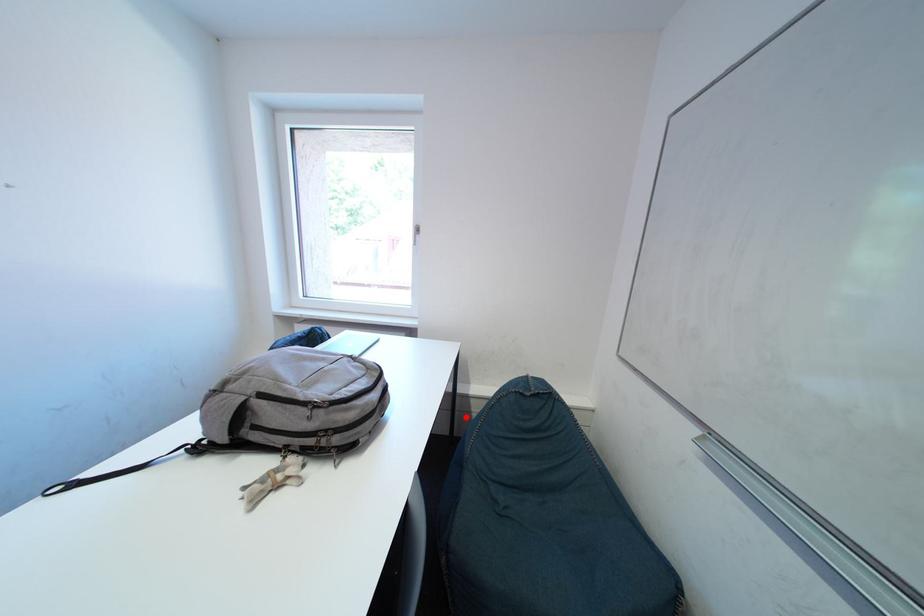
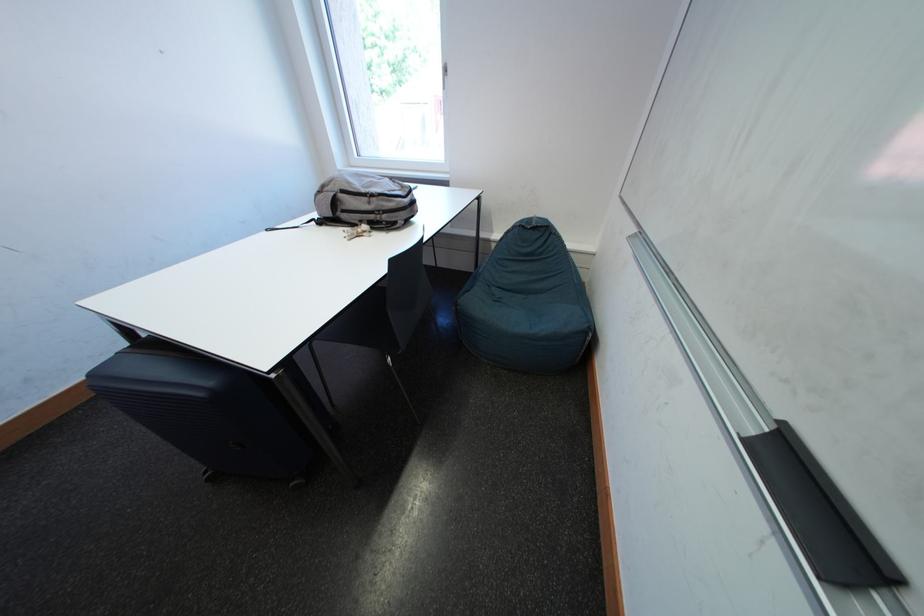
Question: I am providing you with two images of the same scene from different viewpoints. In image1, a red point is highlighted. Considering the same 3D point in image2, which of the following is correct?

Choices:
 (A) It is closer
 (B) It is farther

Answer: (A)